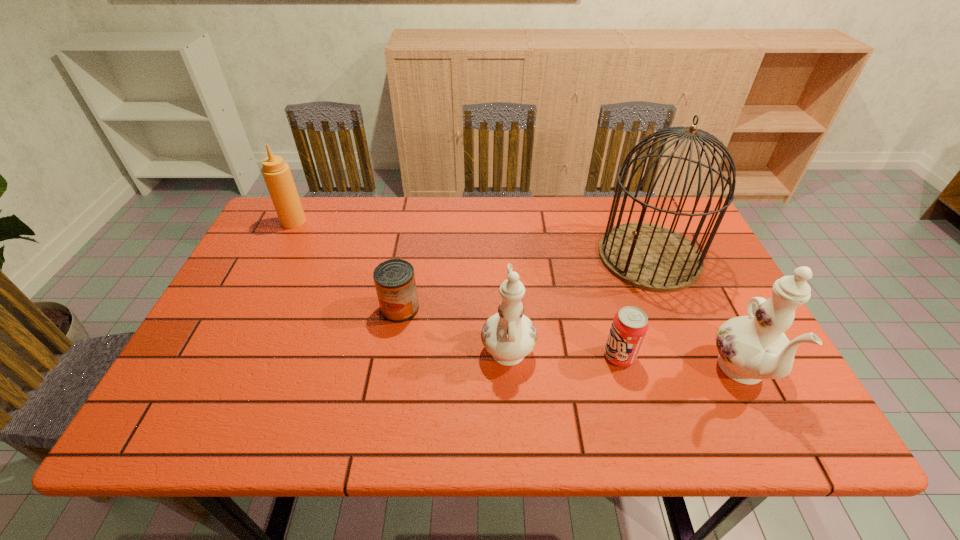
The chinawares are evenly distributed in the image. To maintain this, where would you place another chinaware on the left? Please point to a free space. Please provide its 2D coordinates. Your answer should be formatted as a tuple, i.e. [(x, y)], where the tuple contains the x and y coordinates of a point satisfying the conditions above.

[(296, 321)]